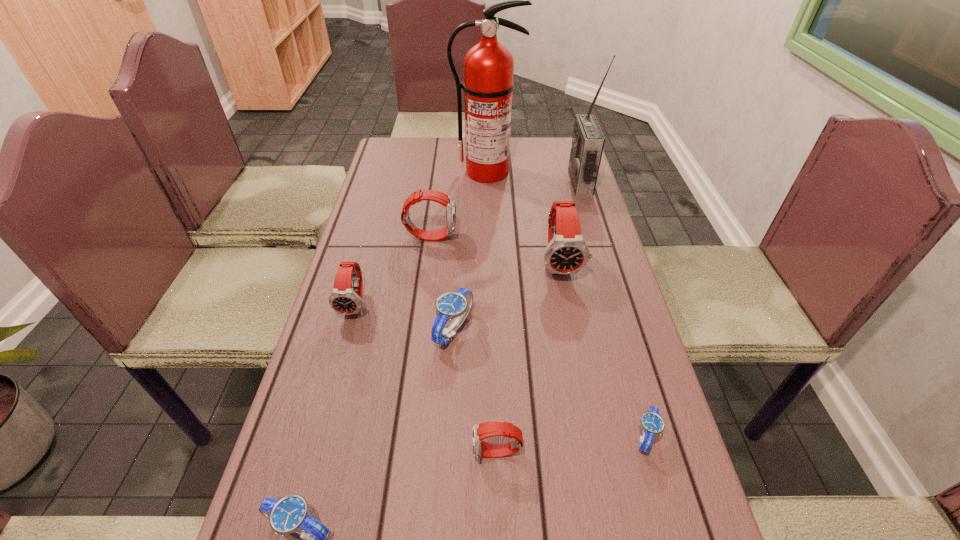
This screenshot has width=960, height=540. In order to click on free space located 0.200m on the face of the third smallest red watch in this screenshot , I will do `click(525, 236)`.

Identify the location of vacant point located 0.220m on the face of the leftmost red watch. Image resolution: width=960 pixels, height=540 pixels. (x=328, y=406).

Identify the location of vacant area located 0.070m on the left of the second blue watch from right to left. The width and height of the screenshot is (960, 540). (404, 329).

The image size is (960, 540). Find the location of `free spot located on the face of the nearest red watch`. free spot located on the face of the nearest red watch is located at coordinates (345, 453).

Locate an element on the screen. This screenshot has height=540, width=960. free space located 0.250m on the face of the nearest red watch is located at coordinates (340, 453).

This screenshot has width=960, height=540. I want to click on free region located on the face of the nearest red watch, so click(x=307, y=453).

At what (x,y) coordinates should I click in order to perform the action: click on free space located 0.200m on the left of the rightmost watch. Please return your answer as a coordinate pair (x, y). Looking at the image, I should click on pos(528,436).

This screenshot has height=540, width=960. Identify the location of fire extinguisher that is at the far edge. (488, 85).

Locate an element on the screen. The width and height of the screenshot is (960, 540). radio receiver present at the far edge is located at coordinates (588, 140).

I want to click on radio receiver that is at the right edge, so click(x=588, y=140).